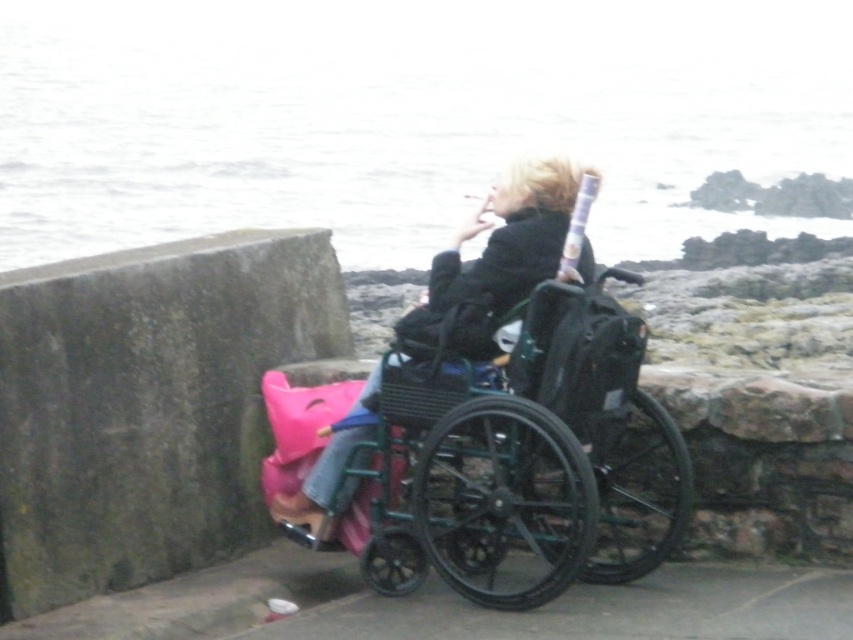
Question: Is white water at upper center in front of metallic green wheelchair at center?

Choices:
 (A) yes
 (B) no

Answer: (B)

Question: Is white water at upper center further to camera compared to matte black wheelchair at center?

Choices:
 (A) yes
 (B) no

Answer: (A)

Question: Which point is closer to the camera taking this photo?

Choices:
 (A) (442, 285)
 (B) (270, 13)
 (C) (555, 468)

Answer: (C)

Question: Among these objects, which one is farthest from the camera?

Choices:
 (A) white water at upper center
 (B) metallic green wheelchair at center
 (C) matte black wheelchair at center

Answer: (A)

Question: Among these objects, which one is nearest to the camera?

Choices:
 (A) white water at upper center
 (B) metallic green wheelchair at center

Answer: (B)

Question: Can you confirm if white water at upper center is bigger than metallic green wheelchair at center?

Choices:
 (A) yes
 (B) no

Answer: (A)